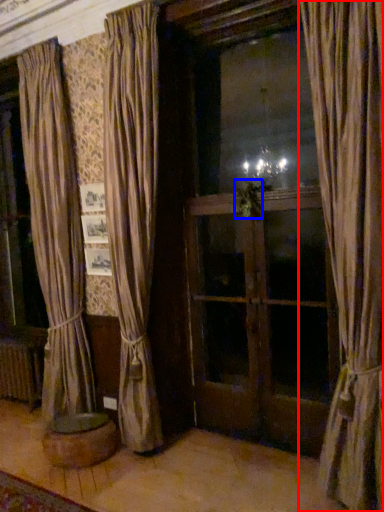
Question: Which object is further to the camera taking this photo, curtain (highlighted by a red box) or plant (highlighted by a blue box)?

Choices:
 (A) curtain
 (B) plant

Answer: (B)